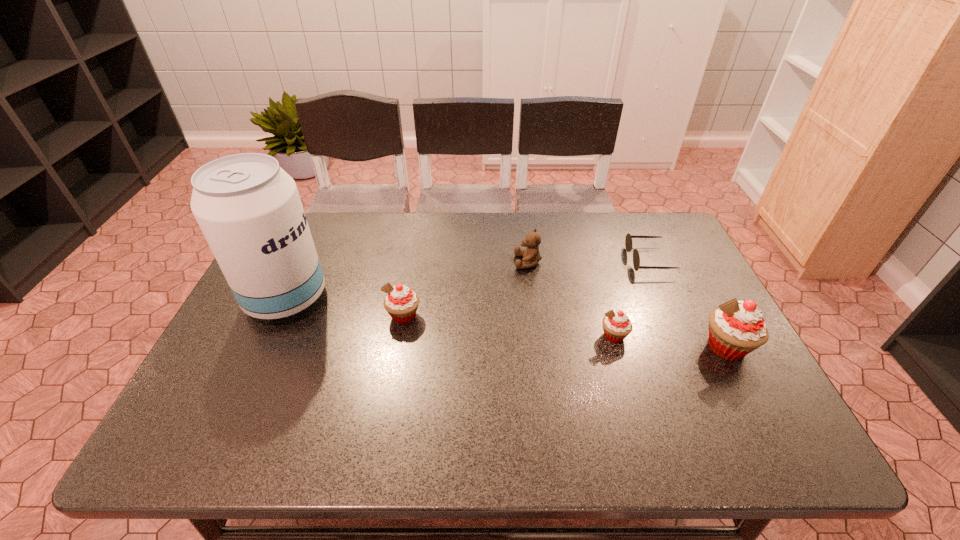
Find the location of `vacant space at the near left corner`. vacant space at the near left corner is located at coordinates (184, 408).

Identify the location of vacant space in between the fourth object from right to left and the shortest cupcake. The height and width of the screenshot is (540, 960). (571, 299).

You are a GUI agent. You are given a task and a screenshot of the screen. Output one action in this format:
    pyautogui.click(x=<x>, y=<y>)
    Task: Click on the free space that is in between the third object from left to right and the shortest object
    Image resolution: width=960 pixels, height=540 pixels.
    Given the screenshot: What is the action you would take?
    pyautogui.click(x=588, y=261)

Find the location of a particular element. This screenshot has height=540, width=960. empty space that is in between the second object from left to right and the rightmost cupcake is located at coordinates click(x=564, y=332).

Identify the location of empty location between the second tallest cupcake and the sunglasses. Image resolution: width=960 pixels, height=540 pixels. (526, 288).

What are the coordinates of `free spot between the alcohol and the teddy bear` in the screenshot? It's located at (407, 280).

Identify the location of vacant space that's between the second tallest cupcake and the fourth object from right to left. (x=466, y=289).

Image resolution: width=960 pixels, height=540 pixels. What are the coordinates of `free spot between the tallest object and the second object from left to right` in the screenshot? It's located at (345, 307).

Where is `empty space that is in between the leftmost cupcake and the shortest object`? This screenshot has height=540, width=960. empty space that is in between the leftmost cupcake and the shortest object is located at coordinates pos(526,288).

You are a GUI agent. You are given a task and a screenshot of the screen. Output one action in this format:
    pyautogui.click(x=<x>, y=<y>)
    Task: Click on the free point between the fourth object from right to left and the tallest object
    Image resolution: width=960 pixels, height=540 pixels.
    Given the screenshot: What is the action you would take?
    pyautogui.click(x=407, y=280)